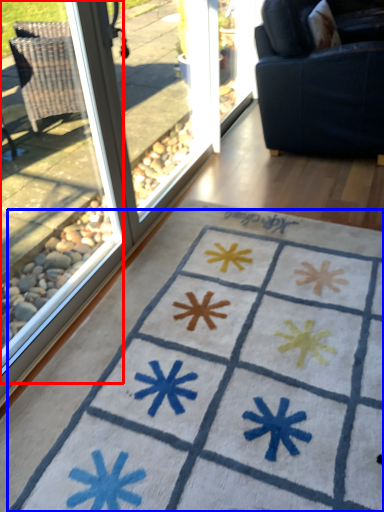
Question: Which of the following is the closest to the observer, window (highlighted by a red box) or doormat (highlighted by a blue box)?

Choices:
 (A) window
 (B) doormat

Answer: (A)